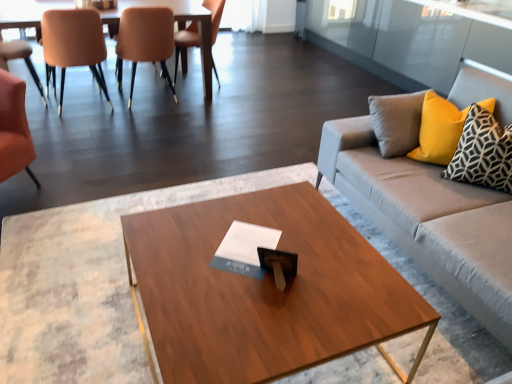
Question: From a real-world perspective, is gray fabric couch at right physically located above or below matte orange chair at left, arranged as the 3th chair when viewed from the left?

Choices:
 (A) below
 (B) above

Answer: (A)

Question: Is point (392, 167) closer or farther from the camera than point (83, 43)?

Choices:
 (A) farther
 (B) closer

Answer: (B)

Question: Estimate the real-world distances between objects in this image. Which object is closer to the wooden table at upper left?

Choices:
 (A) wooden coffee table at center
 (B) orange leather chair at left, placed as the second chair when sorted from left to right
 (C) matte orange chair at left, arranged as the 2th chair when viewed from the right
 (D) gray fabric couch at right
 (E) yellow fabric pillow at right, which is the second pillow in back-to-front order

Answer: (C)

Question: Based on their relative distances, which object is nearer to the matte orange chair at left, arranged as the 2th chair when viewed from the right?

Choices:
 (A) yellow fabric pillow at right, marked as the first pillow in a back-to-front arrangement
 (B) matte orange chair at left, arranged as the 3th chair when viewed from the left
 (C) leather chair at upper left, arranged as the first chair when viewed from the right
 (D) matte orange chair at left, the 5th chair positioned from the right
 (E) wooden coffee table at center

Answer: (B)